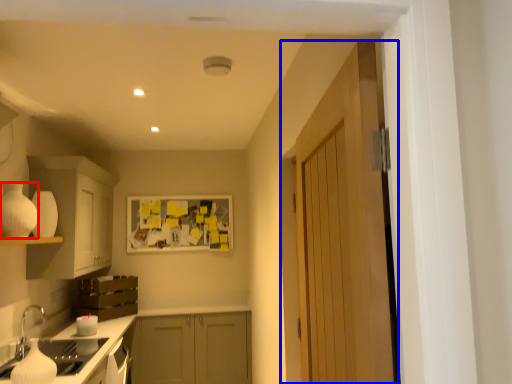
Question: Which object is further to the camera taking this photo, appliance (highlighted by a red box) or door (highlighted by a blue box)?

Choices:
 (A) appliance
 (B) door

Answer: (A)